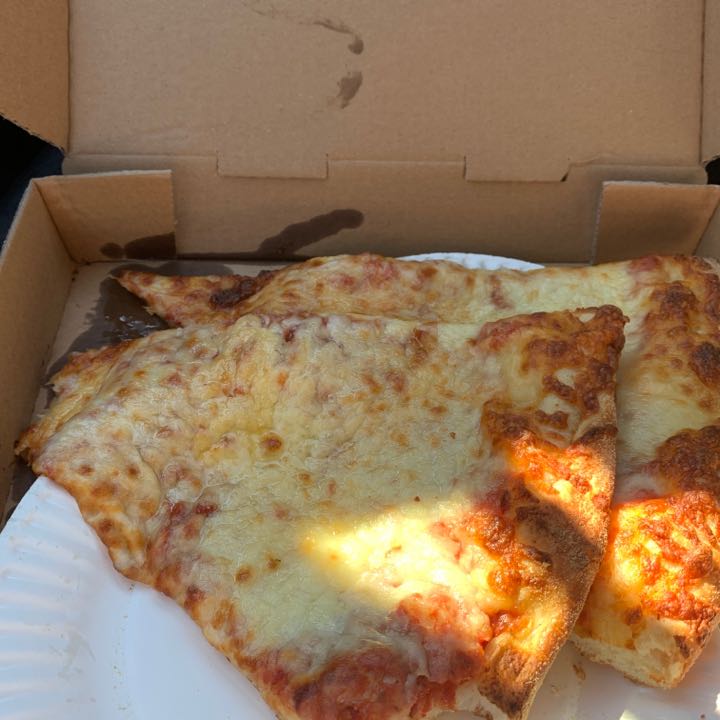
You are a GUI agent. You are given a task and a screenshot of the screen. Output one action in this format:
    pyautogui.click(x=<x>, y=<y>)
    Task: Click on the grease stain on box
    The width and height of the screenshot is (720, 720).
    Given the screenshot: What is the action you would take?
    pyautogui.click(x=122, y=315), pyautogui.click(x=279, y=235), pyautogui.click(x=346, y=89), pyautogui.click(x=354, y=45)